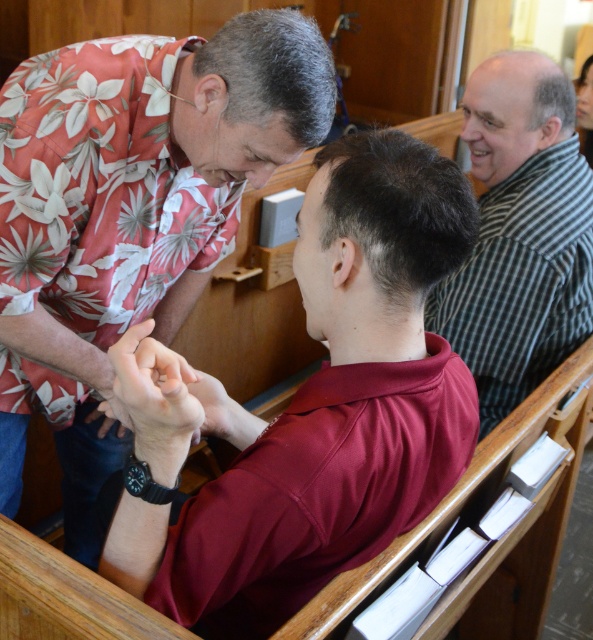
Question: Is striped cotton shirt at upper right above smooth skin hand at center?

Choices:
 (A) no
 (B) yes

Answer: (B)

Question: Is floral print shirt at upper left above smooth skin hand at center?

Choices:
 (A) yes
 (B) no

Answer: (A)

Question: Which of the following is the closest to the observer?

Choices:
 (A) (180, 524)
 (B) (117, 147)
 (C) (138, 449)

Answer: (C)

Question: Which object is the closest to the smooth skin hand at center?

Choices:
 (A) floral print shirt at upper left
 (B) striped cotton shirt at upper right
 (C) maroon jersey at center

Answer: (C)

Question: Does maroon jersey at center appear over floral print shirt at upper left?

Choices:
 (A) no
 (B) yes

Answer: (A)

Question: Among these points, which one is farthest from the camera?

Choices:
 (A) (x=546, y=202)
 (B) (x=224, y=125)
 (C) (x=209, y=376)
 (D) (x=390, y=506)

Answer: (A)